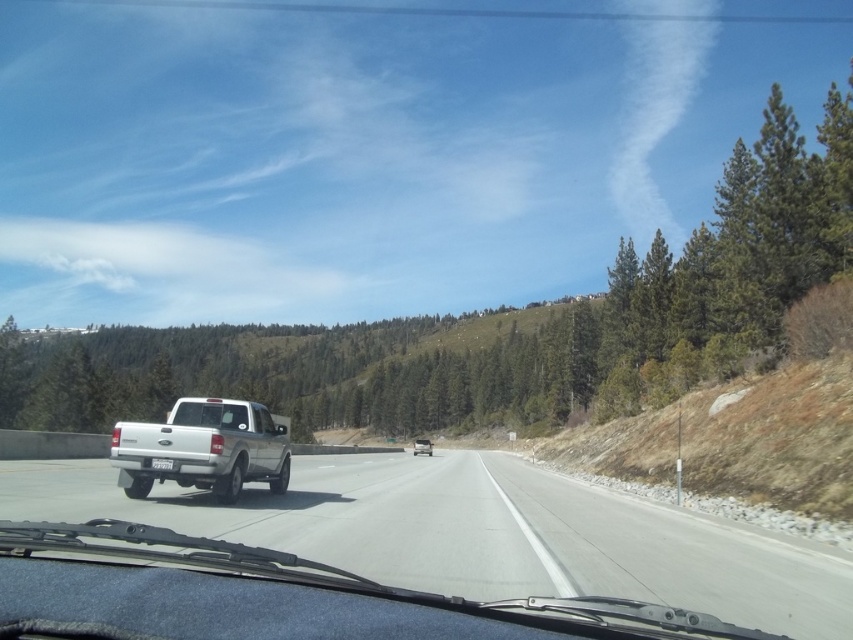
You are driving a car and want to overtake the white glossy truck at center. The clear glass windshield at center is your reference point. Can you safely pass the truck without crossing the center line? Explain your reasoning using the objects mentioned.

The white glossy truck at center is wider than the clear glass windshield at center. Since the truck is wider than the windshield, overtaking while staying within your lane may be challenging. It is safer to wait for a wider section of the road before attempting to pass the truck without crossing the center line.

You are driving a car and see two trucks ahead on the highway. The white glossy truck at center and the white matte pickup truck at center. Which truck is closer to your vehicle?

The white glossy truck at center is closer because it is positioned in front of the white matte pickup truck at center.

You are sitting in the driver seat of the vehicle shown in the image. There is a white glossy truck at center represented by point (488, 534). If you want to avoid hitting the truck, should you steer left or right?

The white glossy truck at center is represented by point (488, 534). To avoid hitting it, you should steer right since the truck is on the left side of the road, and steering right would move your vehicle away from it.